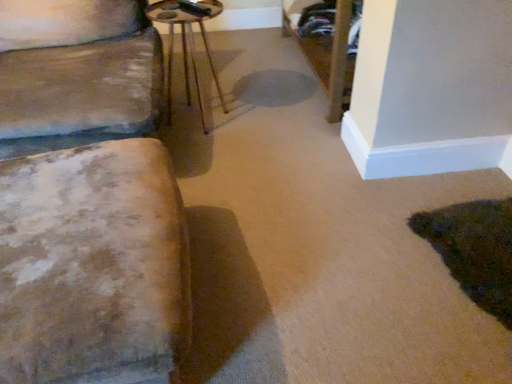
Identify the location of vacant space underneath metallic brown side table at center (from a real-world perspective). (200, 119).